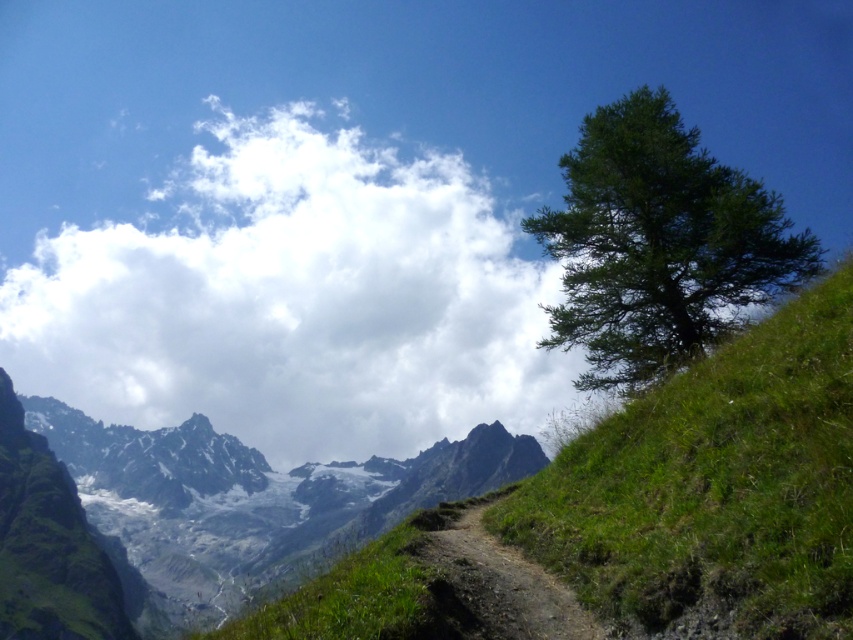
You are an astronomer analyzing the image. You need to determine the exact position of the white fluffy cloud at upper center in the image. What are its coordinates?

The white fluffy cloud at upper center is located at coordinates 0.470 in the x axis and 0.347 in the y axis.

Based on the scene description, which object takes up more area in the image? Please choose between the green grassy hillside at right and the snowy granite mountains at center.

The snowy granite mountains at center occupy more space than the green grassy hillside at right according to the description.

You are a hiker planning to cross the green grassy hillside at right and the snowy granite mountains at center. Which terrain will require more horizontal space to traverse?

The snowy granite mountains at center require more horizontal space to traverse since they are wider than the green grassy hillside at right.